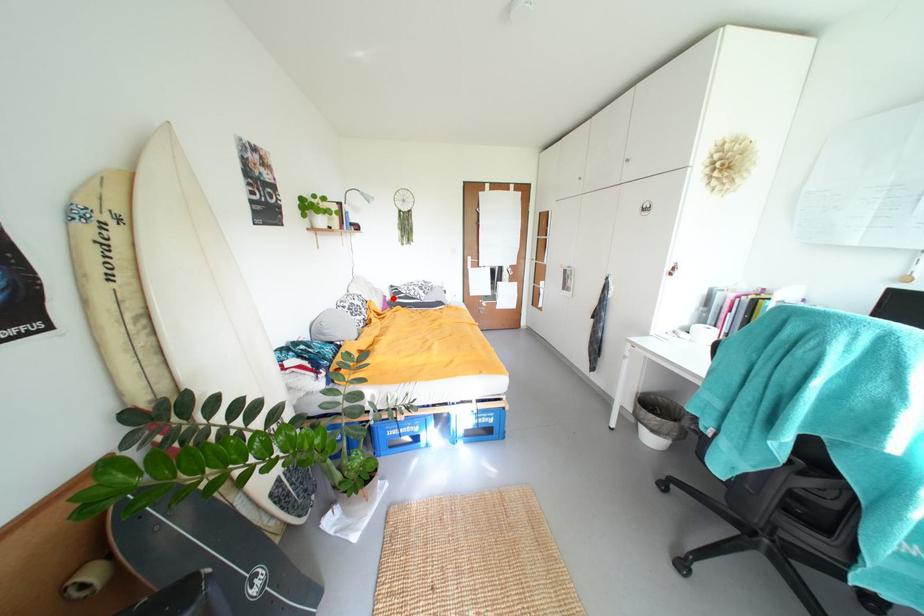
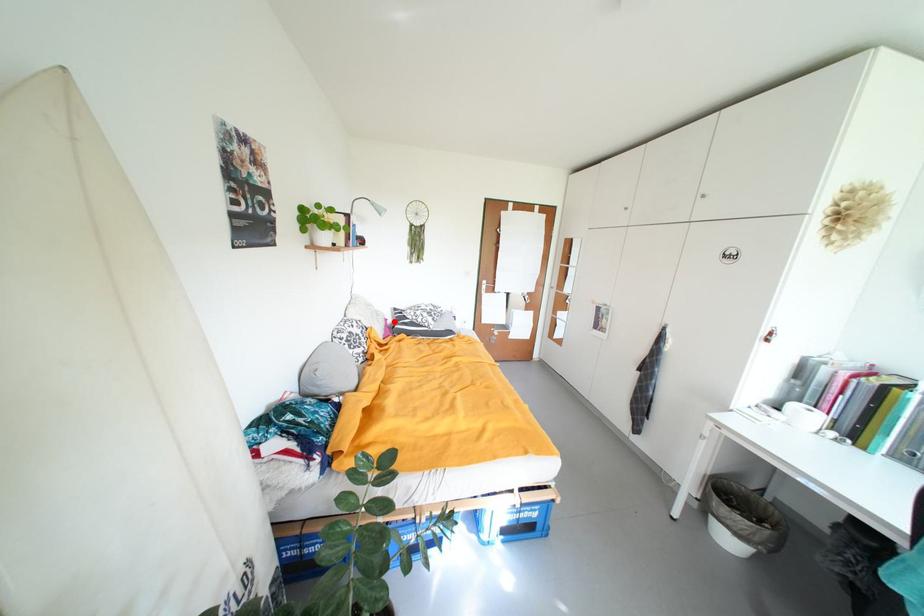
I am providing you with two images of the same scene from different viewpoints. A red point is marked on the first image and another point is marked on the second image. Does the point marked in image1 correspond to the same location as the one in image2?

Yes